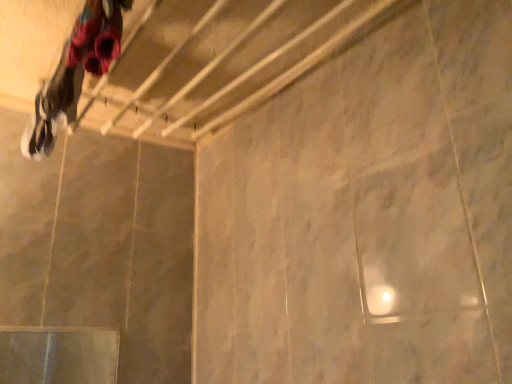
What do you see at coordinates (75, 72) in the screenshot? This screenshot has height=384, width=512. I see `white leather sneakers at upper left` at bounding box center [75, 72].

Identify the location of white leather sneakers at upper left. This screenshot has width=512, height=384. (75, 72).

Locate an element on the screen. white leather sneakers at upper left is located at coordinates (75, 72).